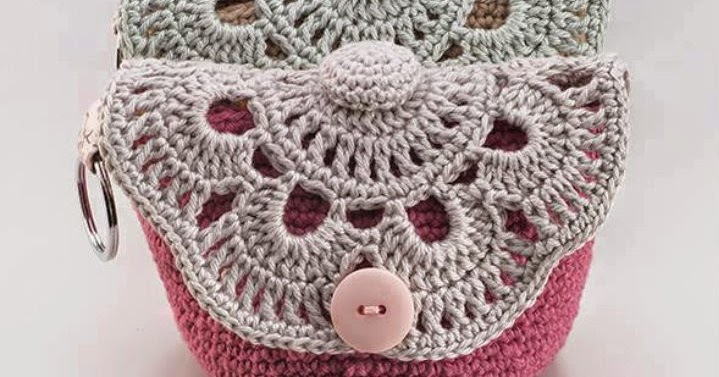
At what (x,y) coordinates should I click in order to perform the action: click on crocheted wool cover. Please return your answer as a coordinate pair (x, y). Image resolution: width=719 pixels, height=377 pixels. Looking at the image, I should click on (523, 97).